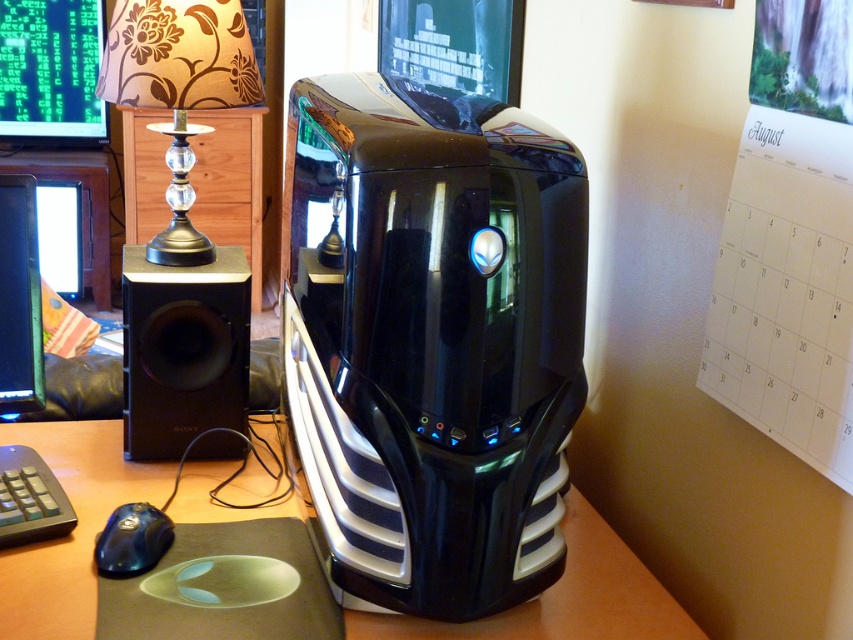
You are setting up a home theater system and need to place a 7.5 feet long cable between the black matte speaker at left and the matte black monitor at left. Based on the image, will the cable be long enough?

The black matte speaker at left and the matte black monitor at left are 7.37 feet apart. The 7.5 feet cable is slightly longer than the distance between them, so it should be sufficient.

You are a photographer setting up a shot of the workspace. You need to focus on two specific points in the scene. The first point is at coordinates point (244, 324) and the second is at point (49, 502). Which point is closer to your camera lens?

Point (244, 324) is closer to the camera lens than point (49, 502) because it is further to the viewer.

In the scene shown: You are setting up a new desk and want to place a black matte speaker at left and a black rubberized keyboard at lower left. The distance between them must be exactly 12 inches. Based on the current setup, will you need to move the speaker or the keyboard to achieve this?

The black matte speaker at left is currently 11.82 inches from the black rubberized keyboard at lower left. To reach the required 12 inches, you need to move either the speaker or the keyboard slightly farther apart by approximately 0.18 inches.